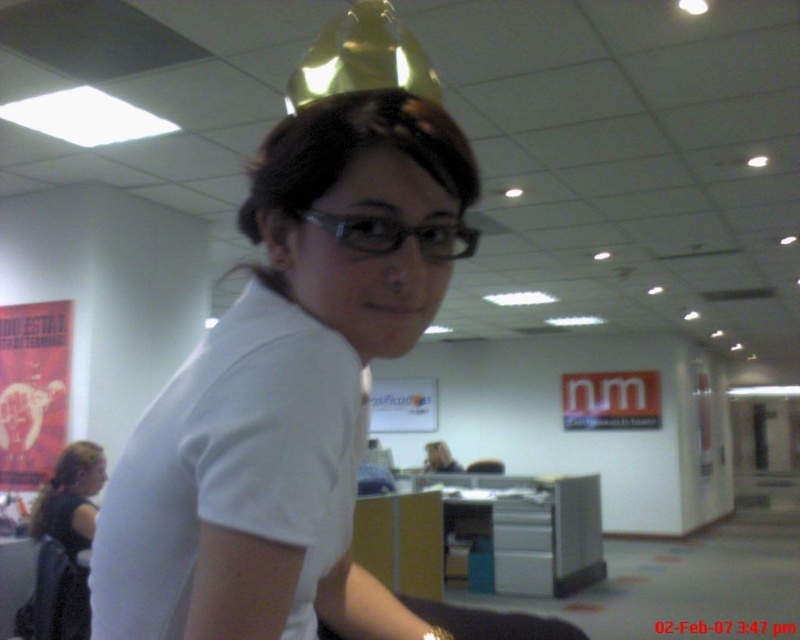
Question: Observing the image, what is the correct spatial positioning of red paper poster at left in reference to black fabric swivel chair at lower left?

Choices:
 (A) right
 (B) left

Answer: (B)

Question: Which of the following is the farthest from the observer?

Choices:
 (A) (60, 417)
 (B) (100, 449)
 (C) (76, 554)
 (D) (54, 512)

Answer: (A)

Question: Can you confirm if white matte t-shirt at center is positioned to the left of red paper poster at left?

Choices:
 (A) yes
 (B) no

Answer: (B)

Question: Estimate the real-world distances between objects in this image. Which object is farther from the matte white head at center?

Choices:
 (A) white matte t-shirt at center
 (B) blonde hair at lower left

Answer: (B)

Question: Is red paper poster at left further to the viewer compared to dark brown hair at lower left?

Choices:
 (A) no
 (B) yes

Answer: (B)

Question: Which of these objects is positioned farthest from the transparent plastic glasses at center?

Choices:
 (A) white matte shirt at center
 (B) black fabric swivel chair at lower left
 (C) dark brown hair at lower left
 (D) blonde hair at lower left

Answer: (D)